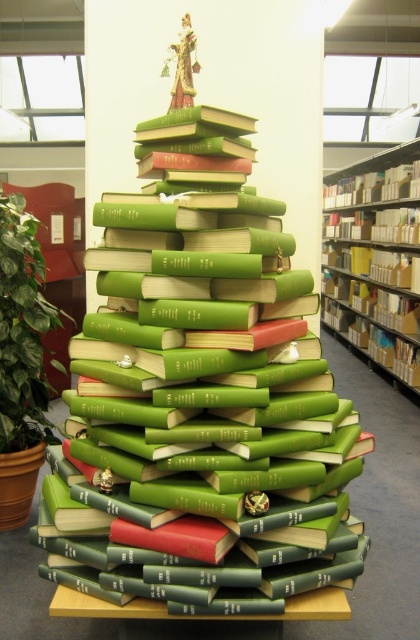
You are organizing a holiday display and need to place both the yellow cardboard bookshelf at right and the green leafy plant at left. According to the scene, which object should be placed on the right side of the other?

The yellow cardboard bookshelf at right is positioned on the right side of the green leafy plant at left, so the bookshelf should be placed to the right of the plant.